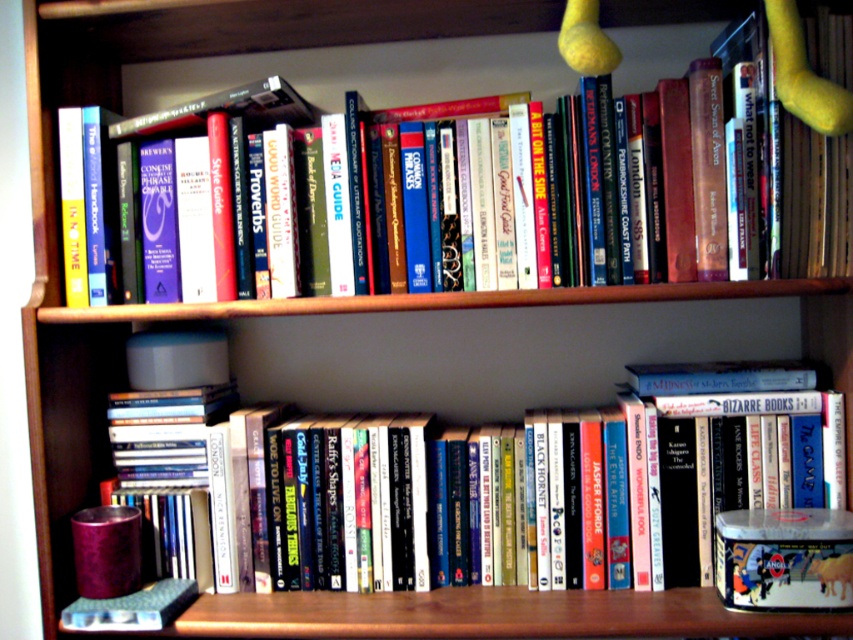
In the scene shown: Does hardcover book at lower center appear under hardcover book at upper center?

Correct, hardcover book at lower center is located below hardcover book at upper center.

The height and width of the screenshot is (640, 853). Describe the element at coordinates (347, 502) in the screenshot. I see `hardcover book at lower center` at that location.

Where is `hardcover book at lower center`? The image size is (853, 640). hardcover book at lower center is located at coordinates (347, 502).